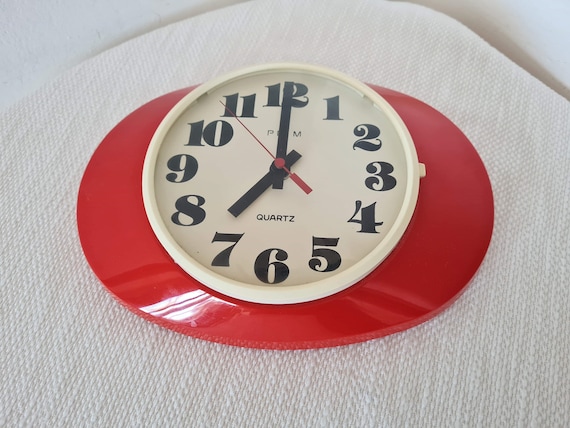
The width and height of the screenshot is (570, 428). In order to click on "1" on clock face in this screenshot , I will do `click(332, 109)`.